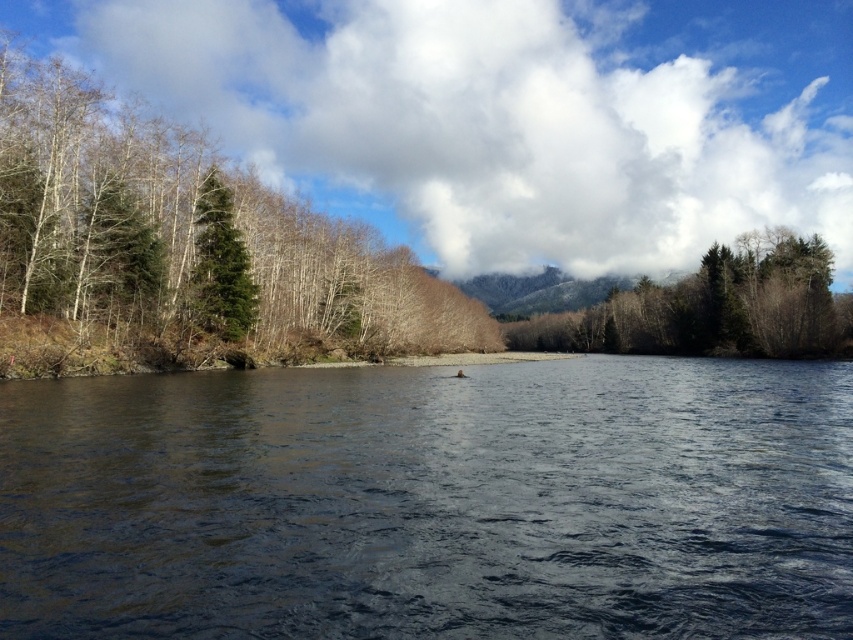
Question: Which point is closer to the camera taking this photo?

Choices:
 (A) (27, 576)
 (B) (529, 321)

Answer: (A)

Question: Does white fluffy cloud at upper center have a greater width compared to green matte tree at left?

Choices:
 (A) no
 (B) yes

Answer: (B)

Question: Which is nearer to the bare branches at left?

Choices:
 (A) green matte tree at left
 (B) green matte trees at center

Answer: (A)

Question: From the image, what is the correct spatial relationship of dark water at center in relation to white fluffy cloud at upper center?

Choices:
 (A) left
 (B) right

Answer: (A)

Question: Among these points, which one is nearest to the camera?

Choices:
 (A) (712, 305)
 (B) (184, 49)
 (C) (140, 268)
 (D) (144, 602)

Answer: (D)

Question: Does dark water at center appear on the left side of green matte trees at center?

Choices:
 (A) yes
 (B) no

Answer: (A)